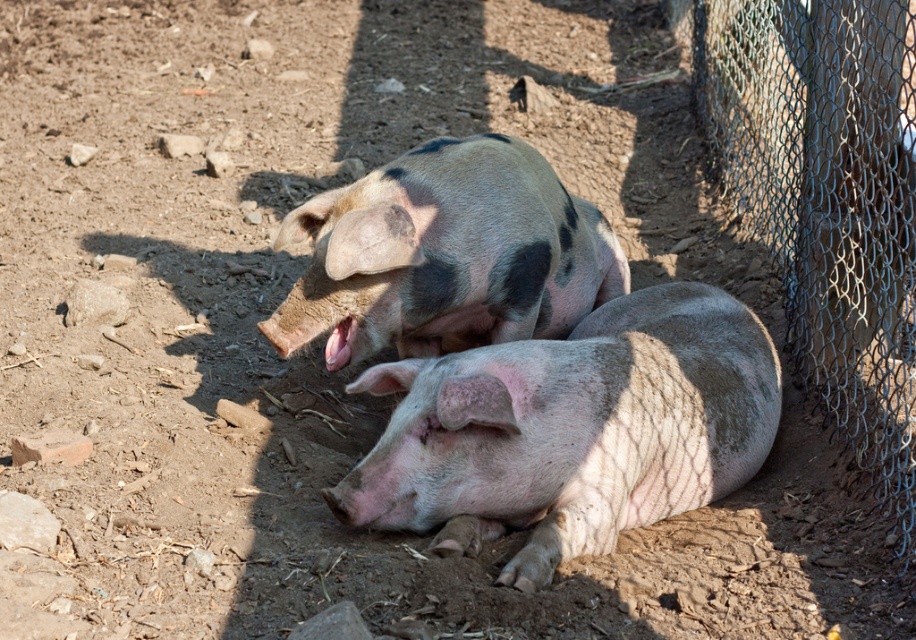
You are a farmer checking on your pigs in the fenced area. You notice the pink textured skin at center and the speckled pink pig at center. Which object is located lower in the image?

The pink textured skin at center is located lower in the image because it is below the speckled pink pig at center.

In the scene shown: You are standing in front of the fenced area where two pigs are resting. There are two points marked on the ground at coordinates point (760,394) and point (823,381). If you want to place a small treat exactly halfway between these two points, where should you aim? Please describe the location relative to the pigs.

The halfway point between point (760,394) and point (823,381) would be closer to the pig lying in the foreground since point (760,394) is nearer to the viewer. The exact coordinates would be the average of the two points, but since the question asks for a relative description, it would be positioned between the two points, closer to the foreground pig.